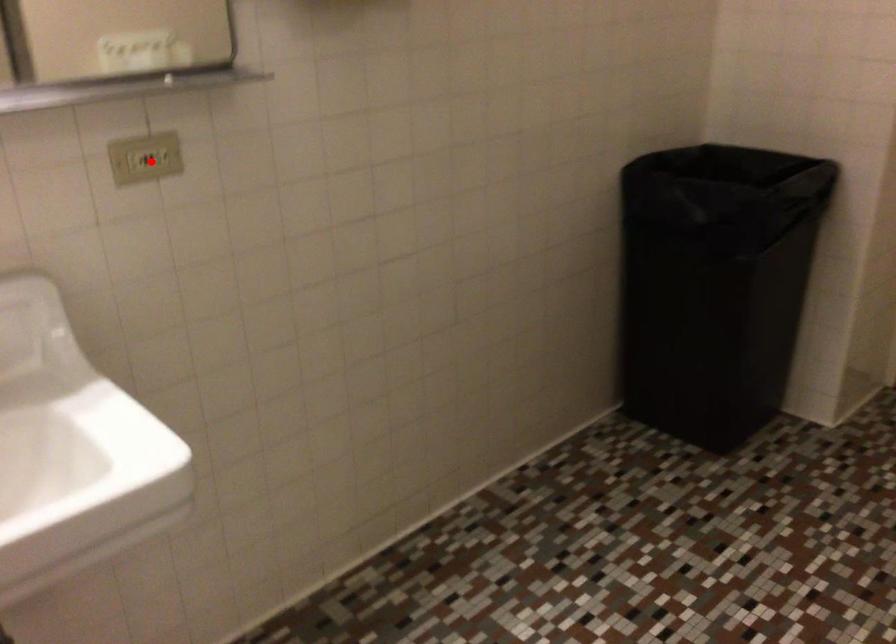
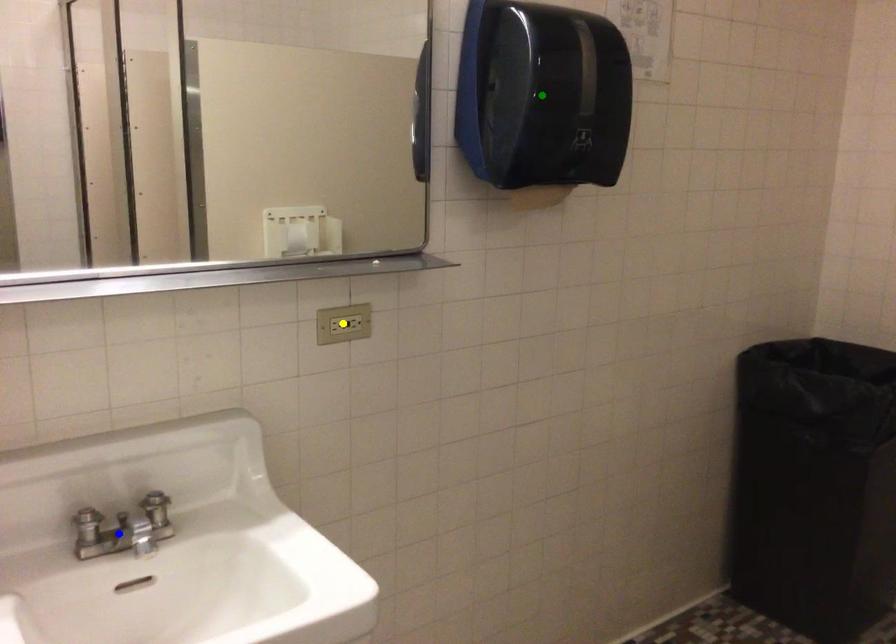
Question: I am providing you with two images of the same scene from different viewpoints. A red point is marked on the first image. You are given multiple points on the second image. Can you choose the point in image 2 that corresponds to the point in image 1?

Choices:
 (A) blue point
 (B) green point
 (C) yellow point

Answer: (C)